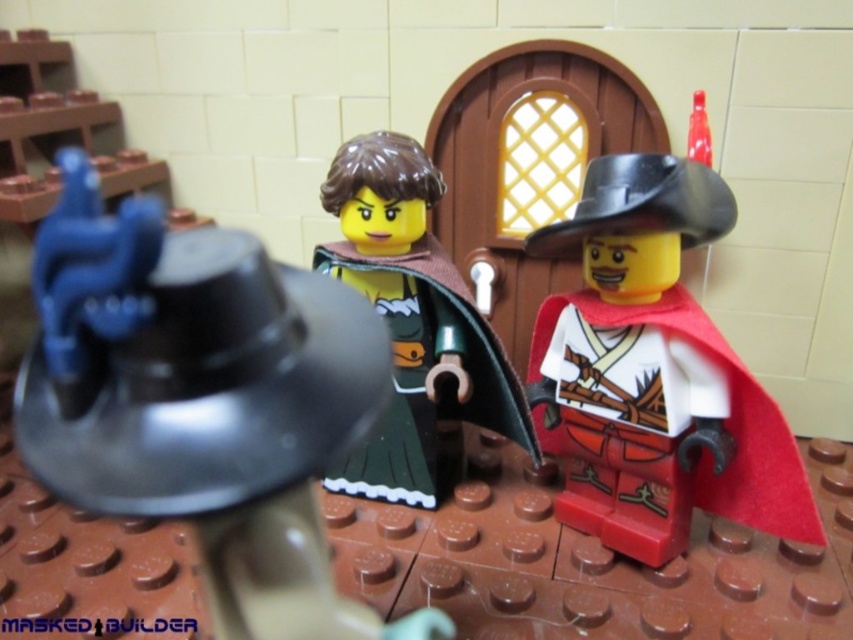
Question: Can you confirm if metallic silver helmet at upper left is positioned to the right of green matte dress at center?

Choices:
 (A) no
 (B) yes

Answer: (A)

Question: Which point appears closest to the camera in this image?

Choices:
 (A) (422, 316)
 (B) (198, 545)

Answer: (B)

Question: Is metallic silver helmet at upper left below green matte dress at center?

Choices:
 (A) no
 (B) yes

Answer: (B)

Question: From the image, what is the correct spatial relationship of metallic silver helmet at upper left in relation to smooth red cape at right?

Choices:
 (A) right
 (B) left

Answer: (B)

Question: Which point appears closest to the camera in this image?

Choices:
 (A) (392, 266)
 (B) (706, 504)

Answer: (A)

Question: Based on their relative distances, which object is nearer to the metallic silver helmet at upper left?

Choices:
 (A) green matte dress at center
 (B) smooth red cape at right

Answer: (B)